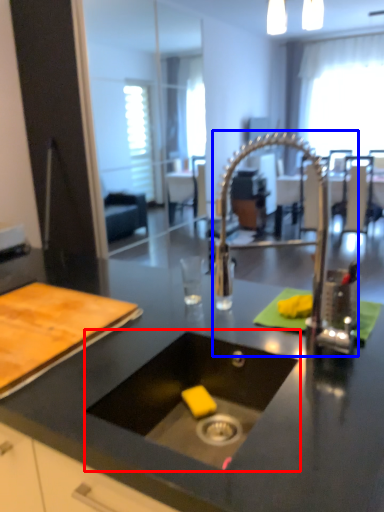
Question: Which object is closer to the camera taking this photo, sink (highlighted by a red box) or faucet (highlighted by a blue box)?

Choices:
 (A) sink
 (B) faucet

Answer: (A)